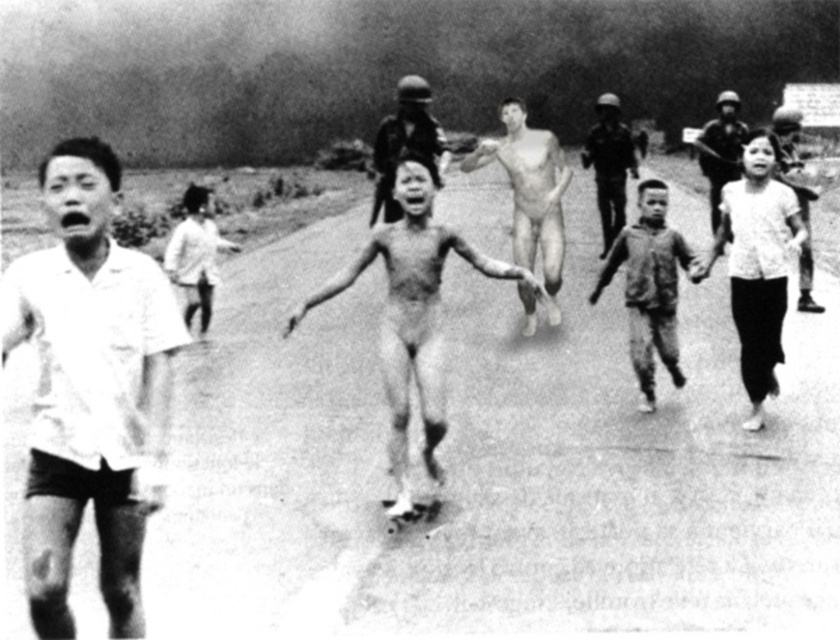
You are a photographer analyzing the composition of this black and white photo. The central girl is running towards the right side of the image. There is a point marked at coordinates (90, 388). Based on the scene description, which object does this point most likely represent?

The point at coordinates (90, 388) corresponds to the white matte shirt at left.

From the picture: You are a photographer who wants to capture a closeup shot of both the white matte shirt at left and the dirty brown shirt at center in the same frame. Given that your camera has a focal length of 50mm and the minimum focusing distance is 1 meter, can you do this without moving closer than 1 meter to either subject?

The white matte shirt at left and the dirty brown shirt at center are 5.21 meters apart. With a 50mm lens, the field of view at 1 meter distance would not be wide enough to include both subjects separated by over 5 meters. Therefore, it is not possible to capture both in the same frame without moving closer than 1 meter.